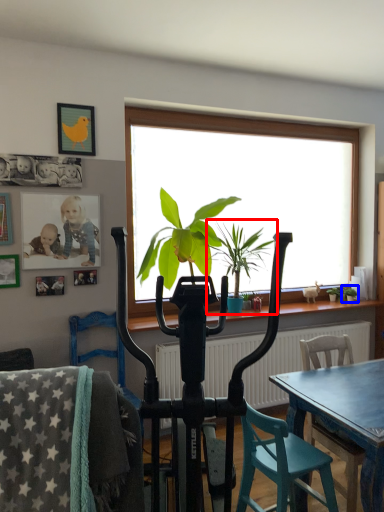
Question: Which object appears closest to the camera in this image, houseplant (highlighted by a red box) or houseplant (highlighted by a blue box)?

Choices:
 (A) houseplant
 (B) houseplant

Answer: (A)